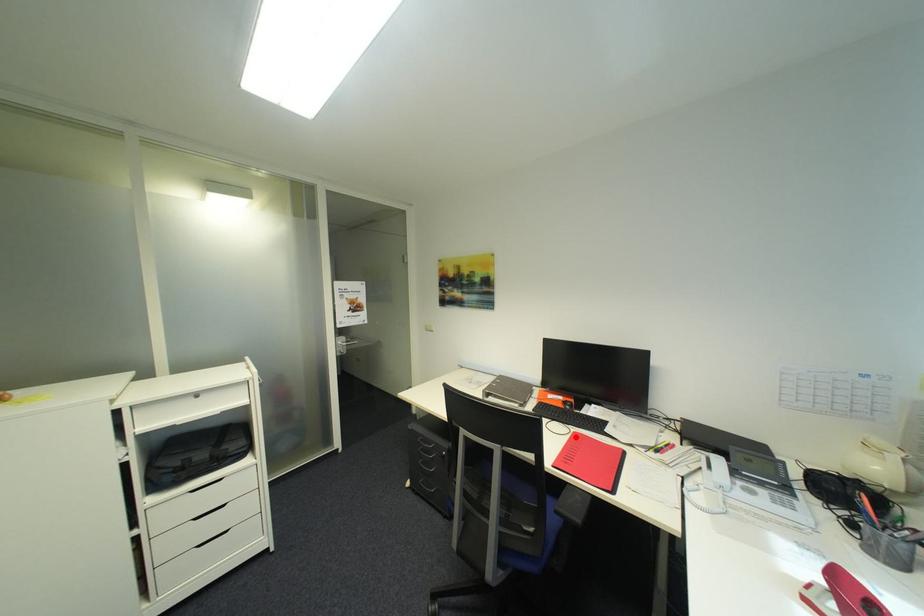
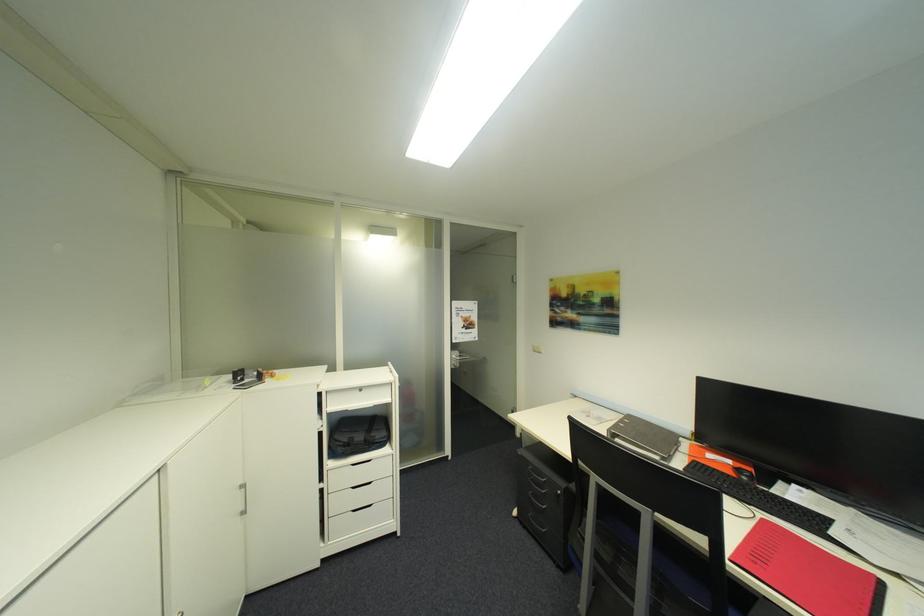
In the second image, find the point that corresponds to the highlighted location in the first image.

(760, 524)